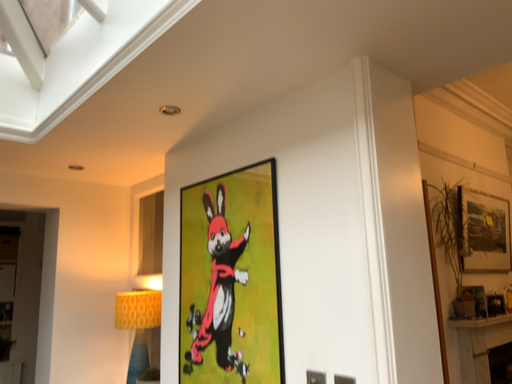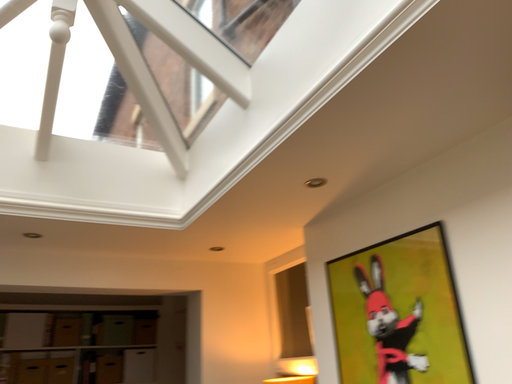
Question: How did the camera likely rotate when shooting the video?

Choices:
 (A) rotated left
 (B) rotated right

Answer: (A)